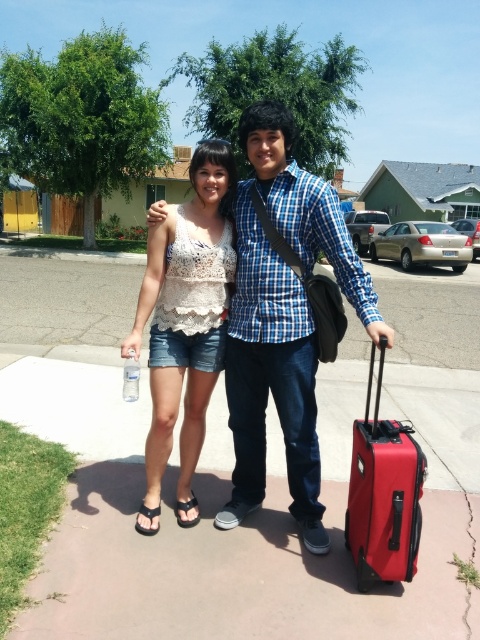
Question: Which point is farther from the camera taking this photo?

Choices:
 (A) (178, 518)
 (B) (126, 385)
 (C) (183, 445)

Answer: (C)

Question: Based on their relative distances, which object is nearer to the clear plastic bottle at lower left?

Choices:
 (A) black fabric sandal at lower left
 (B) red matte suitcase at lower right
 (C) blue checkered shirt at center
 (D) black leather sandal at lower left

Answer: (A)

Question: Can you confirm if black leather sandal at lower left is smaller than black fabric sandal at lower left?

Choices:
 (A) no
 (B) yes

Answer: (A)

Question: Which object is positioned farthest from the black leather sandal at lower left?

Choices:
 (A) black fabric sandal at lower left
 (B) white lace tank top at center
 (C) clear plastic bottle at lower left

Answer: (C)

Question: Considering the relative positions of red matte suitcase at lower right and black leather sandal at lower left in the image provided, where is red matte suitcase at lower right located with respect to black leather sandal at lower left?

Choices:
 (A) below
 (B) above

Answer: (B)

Question: Does white lace tank top at center lie behind red matte suitcase at lower right?

Choices:
 (A) no
 (B) yes

Answer: (B)